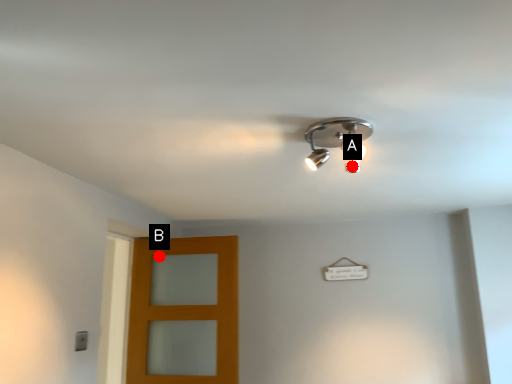
Question: Two points are circled on the image, labeled by A and B beside each circle. Which of the following is the closest to the observer?

Choices:
 (A) A is closer
 (B) B is closer

Answer: (A)